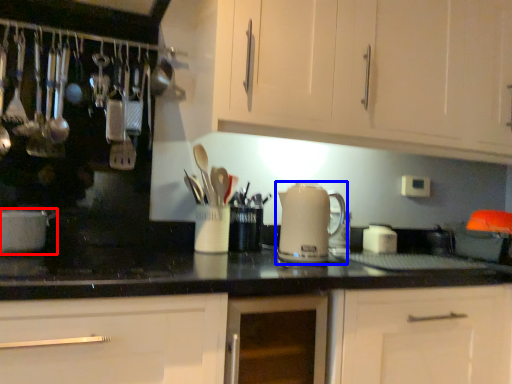
Question: Among these objects, which one is farthest to the camera, home appliance (highlighted by a red box) or kitchen appliance (highlighted by a blue box)?

Choices:
 (A) home appliance
 (B) kitchen appliance

Answer: (B)